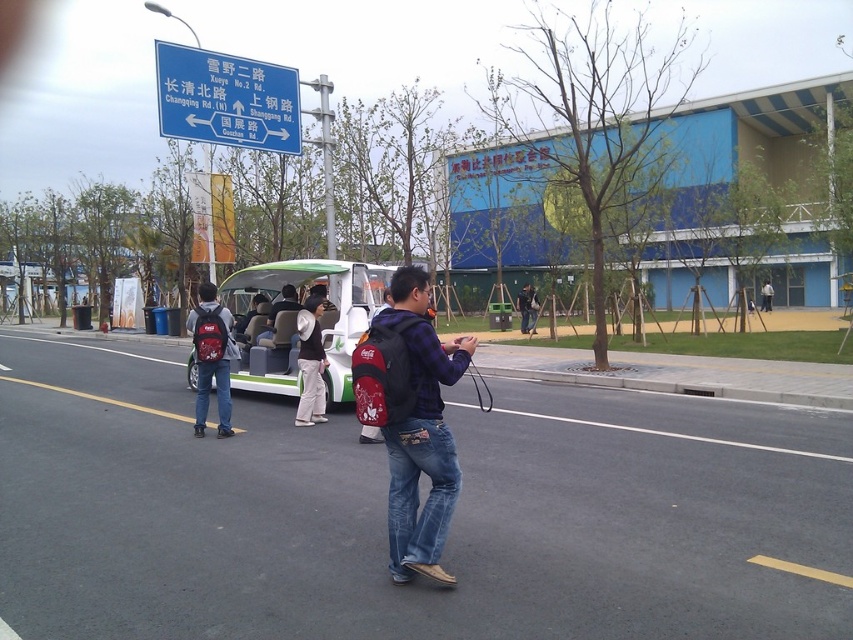
Question: Estimate the real-world distances between objects in this image. Which object is closer to the green matte bus at center?

Choices:
 (A) matte blue backpack at center
 (B) denim jacket at center
 (C) blue plastic sign at upper center
 (D) white cotton hat at center

Answer: (D)

Question: Which of the following is the farthest from the observer?

Choices:
 (A) (769, 304)
 (B) (289, 304)

Answer: (A)

Question: From the image, what is the correct spatial relationship of matte black backpack at center in relation to denim jacket at center?

Choices:
 (A) right
 (B) left

Answer: (B)

Question: Is matte blue backpack at center thinner than denim jacket at center?

Choices:
 (A) yes
 (B) no

Answer: (B)

Question: Does green matte bus at center appear over matte red backpack at center?

Choices:
 (A) yes
 (B) no

Answer: (B)

Question: Which point is farther to the camera?

Choices:
 (A) (762, 305)
 (B) (395, 458)
 (C) (260, 333)

Answer: (A)